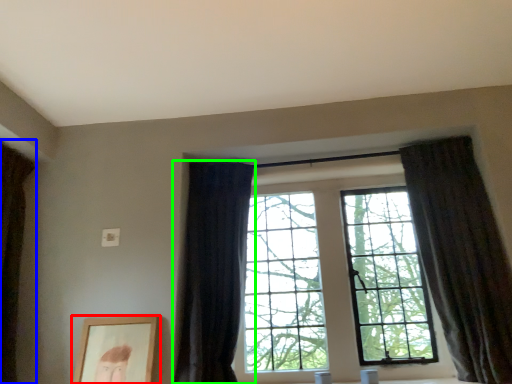
Question: Which object is positioned closest to picture frame (highlighted by a red box)? Select from curtain (highlighted by a blue box) and curtain (highlighted by a green box).

Choices:
 (A) curtain
 (B) curtain

Answer: (B)